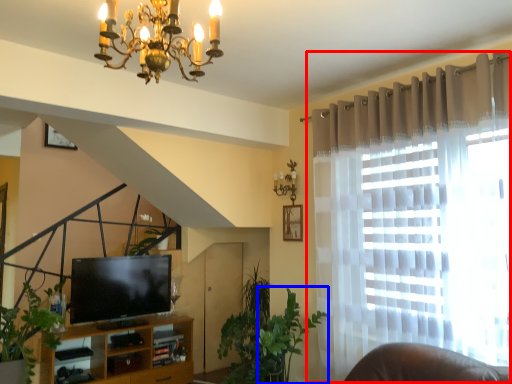
Question: Which of the following is the closest to the observer, curtain (highlighted by a red box) or plant (highlighted by a blue box)?

Choices:
 (A) curtain
 (B) plant

Answer: (A)